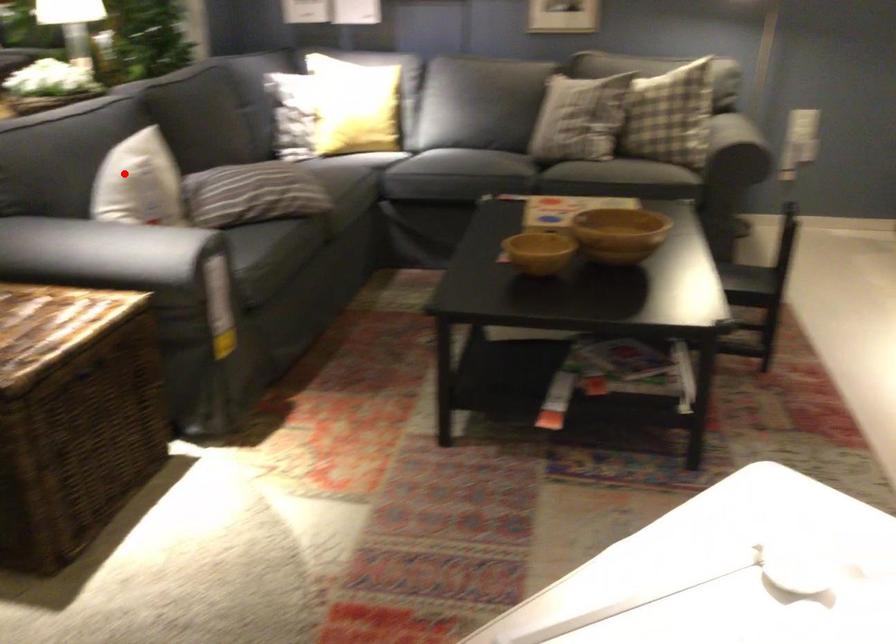
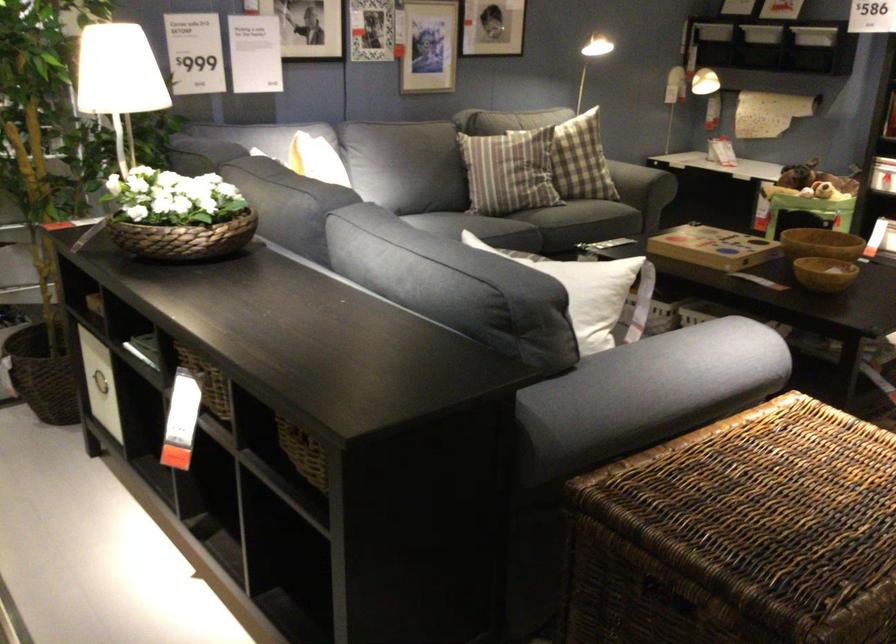
Question: A red point is marked in image1. In image2, is the corresponding 3D point closer to the camera or farther? Reply with the corresponding letter.

Choices:
 (A) The corresponding 3D point is closer.
 (B) The corresponding 3D point is farther.

Answer: (A)